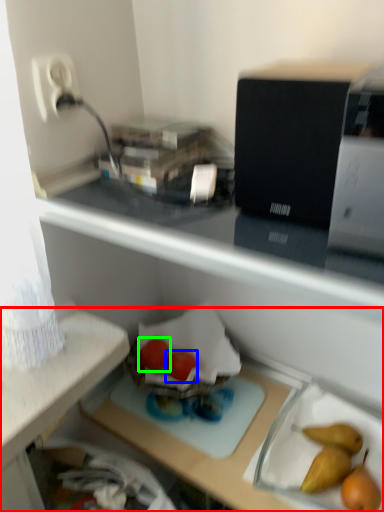
Question: Based on their relative distances, which object is nearer to desk (highlighted by a red box)? Choose from green vegetables (highlighted by a blue box) and green vegetables (highlighted by a green box).

Choices:
 (A) green vegetables
 (B) green vegetables

Answer: (B)